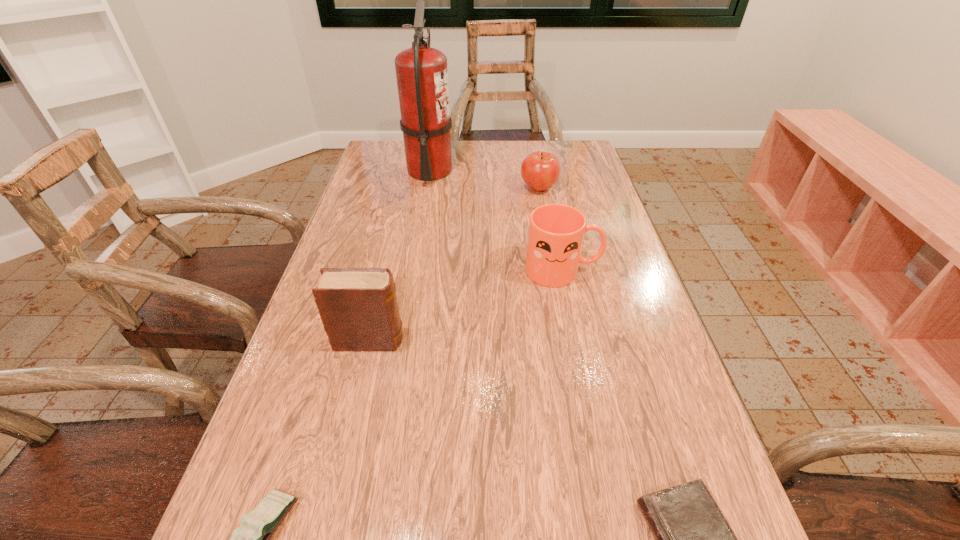
Find the location of a particular element. vacant space that is in between the fourth nearest object and the tallest diary is located at coordinates (467, 305).

The height and width of the screenshot is (540, 960). What are the coordinates of `object that is the fourth closest one to the second shortest diary` in the screenshot? It's located at (421, 71).

The width and height of the screenshot is (960, 540). I want to click on the fourth closest object relative to the second tallest diary, so click(421, 71).

Select which diary appears as the second closest to the farthest diary. Please provide its 2D coordinates. Your answer should be formatted as a tuple, i.e. [(x, y)], where the tuple contains the x and y coordinates of a point satisfying the conditions above.

[(693, 538)]

Select which diary is the closest to the second shortest object. Please provide its 2D coordinates. Your answer should be formatted as a tuple, i.e. [(x, y)], where the tuple contains the x and y coordinates of a point satisfying the conditions above.

[(358, 307)]